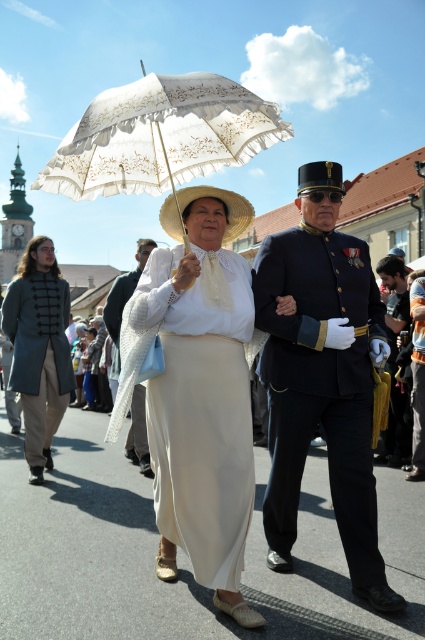
You are a photographer at the historical reenactment. You want to capture a photo where the yellow fabric mask at right is fully visible without being blocked by the white lace umbrella at center. Is this possible given their current positions?

The white lace umbrella at center is in front of the yellow fabric mask at right, so it is blocking the mask. To capture the mask fully visible, you need to adjust their positions or move the umbrella so it is no longer in front of the mask.

You are a photographer positioned at the camera location. You want to capture a closeup shot of the white lace umbrella at center. Considering its distance, is it feasible to do so without moving closer?

The white lace umbrella at center is 99.73 feet from the camera, so capturing a closeup shot without moving closer would be challenging due to the significant distance involved.

You are a photographer at the historical reenactment event. You want to capture a photo where both the shiny dark blue uniform at center and the straw hat at center are visible. Based on their positions, which one should you ensure is closer to the camera to include both in the frame?

The shiny dark blue uniform at center is below the straw hat at center, so to include both in the frame, you should ensure the straw hat at center is closer to the camera.